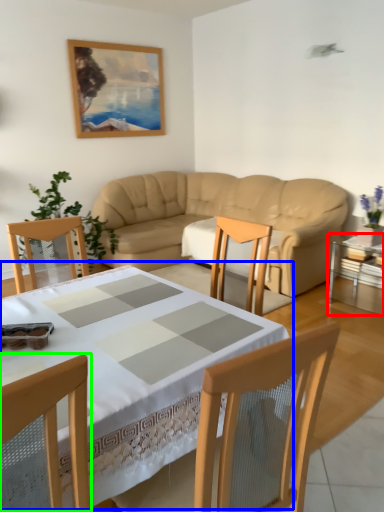
Question: Which object is positioned farthest from table (highlighted by a red box)? Select from table (highlighted by a blue box) and chair (highlighted by a green box).

Choices:
 (A) table
 (B) chair

Answer: (B)